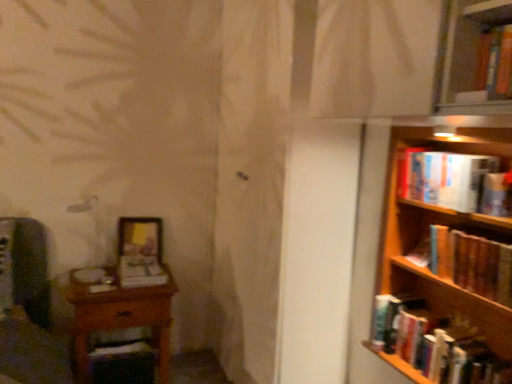
Question: From the image's perspective, is hardcover book at right, the 3th book when ordered from bottom to top, on hardcover book at right, the 1th book from the bottom?

Choices:
 (A) yes
 (B) no

Answer: (A)

Question: Does hardcover book at right, placed as the 1th book when sorted from right to left, have a lesser width compared to hardcover book at right, placed as the 2th book when sorted from right to left?

Choices:
 (A) yes
 (B) no

Answer: (A)

Question: Considering the relative sizes of hardcover book at right, placed as the 1th book when sorted from right to left, and hardcover book at right, placed as the 3th book when sorted from left to right, in the image provided, is hardcover book at right, placed as the 1th book when sorted from right to left, smaller than hardcover book at right, placed as the 3th book when sorted from left to right,?

Choices:
 (A) yes
 (B) no

Answer: (A)

Question: Considering the relative sizes of hardcover book at right, the 3th book when ordered from bottom to top, and hardcover book at right, placed as the 3th book when sorted from left to right, in the image provided, is hardcover book at right, the 3th book when ordered from bottom to top, wider than hardcover book at right, placed as the 3th book when sorted from left to right,?

Choices:
 (A) no
 (B) yes

Answer: (A)

Question: Is hardcover book at right, which ranks as the fourth book in left-to-right order, directly adjacent to hardcover book at right, placed as the 3th book when sorted from left to right?

Choices:
 (A) no
 (B) yes

Answer: (A)

Question: From a real-world perspective, relative to wooden table at left, is hardcover book at upper right, placed as the 2th book when sorted from left to right, vertically above or below?

Choices:
 (A) below
 (B) above

Answer: (B)

Question: Is point (487, 162) positioned closer to the camera than point (75, 339)?

Choices:
 (A) farther
 (B) closer

Answer: (B)

Question: Is hardcover book at upper right, which ranks as the first book in top-to-bottom order, bigger or smaller than wooden table at left?

Choices:
 (A) big
 (B) small

Answer: (B)

Question: Based on their positions, is hardcover book at upper right, the 3th book from the right, located to the left or right of wooden table at left?

Choices:
 (A) left
 (B) right

Answer: (B)

Question: In terms of width, does hardcover book at right, placed as the 2th book when sorted from right to left, look wider or thinner when compared to matte white book at center, the 3th book from the top?

Choices:
 (A) wide
 (B) thin

Answer: (B)

Question: From the image's perspective, is hardcover book at right, the 1th book from the bottom, positioned above or below matte white book at center, which is the first book in left-to-right order?

Choices:
 (A) above
 (B) below

Answer: (B)

Question: From their relative heights in the image, would you say hardcover book at right, the 1th book from the bottom, is taller or shorter than matte white book at center, which is the first book in left-to-right order?

Choices:
 (A) short
 (B) tall

Answer: (B)

Question: Is hardcover book at right, placed as the 3th book when sorted from left to right, spatially inside matte white book at center, which is the 4th book from right to left, or outside of it?

Choices:
 (A) inside
 (B) outside

Answer: (B)

Question: Is hardcover book at right, the 3th book when ordered from bottom to top, to the left or to the right of wooden bookshelf at right in the image?

Choices:
 (A) left
 (B) right

Answer: (B)

Question: Is hardcover book at right, the 3th book when ordered from bottom to top, in front of or behind wooden bookshelf at right in the image?

Choices:
 (A) behind
 (B) front

Answer: (A)